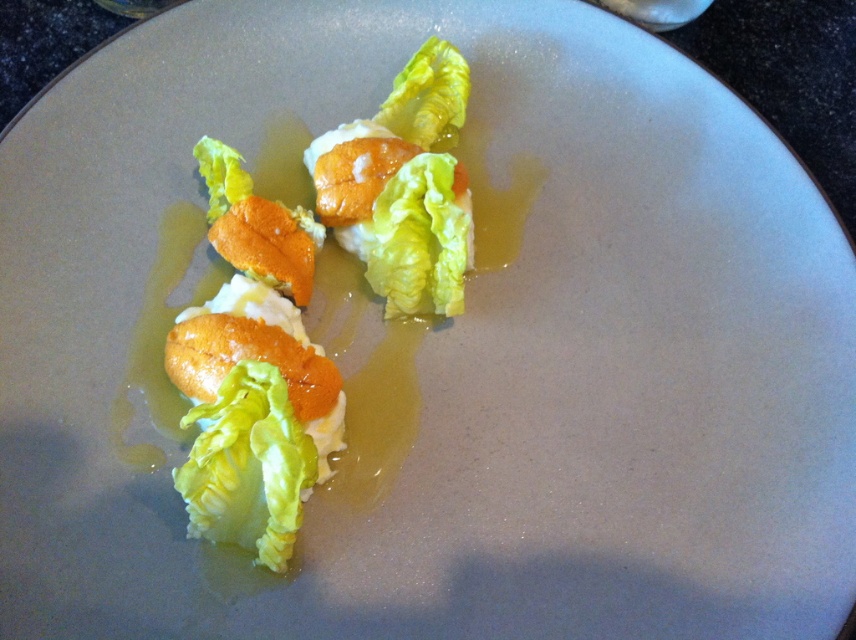
Is point (211, 388) positioned after point (464, 227)?

That is False.

Describe the element at coordinates (308, 300) in the screenshot. I see `matte orange lettuce at center` at that location.

At what (x,y) coordinates should I click in order to perform the action: click on matte orange lettuce at center. Please return your answer as a coordinate pair (x, y). Looking at the image, I should click on (308, 300).

Is point (456, 259) in front of point (254, 397)?

No, (456, 259) is behind (254, 397).

Is matte orange lettuce at center shorter than green leafy lettuce at lower left?

Incorrect, matte orange lettuce at center's height does not fall short of green leafy lettuce at lower left's.

Which is in front, point (310, 220) or point (251, 465)?

Positioned in front is point (251, 465).

Image resolution: width=856 pixels, height=640 pixels. Identify the location of matte orange lettuce at center. (308, 300).

Is green leafy lettuce at lower left to the left of green leafy lettuce at center from the viewer's perspective?

Indeed, green leafy lettuce at lower left is positioned on the left side of green leafy lettuce at center.

Is green leafy lettuce at lower left further to camera compared to green leafy lettuce at center?

That is False.

Who is more forward, [276,433] or [443,196]?

Point [276,433] is in front.

Locate an element on the screen. This screenshot has height=640, width=856. green leafy lettuce at lower left is located at coordinates (248, 465).